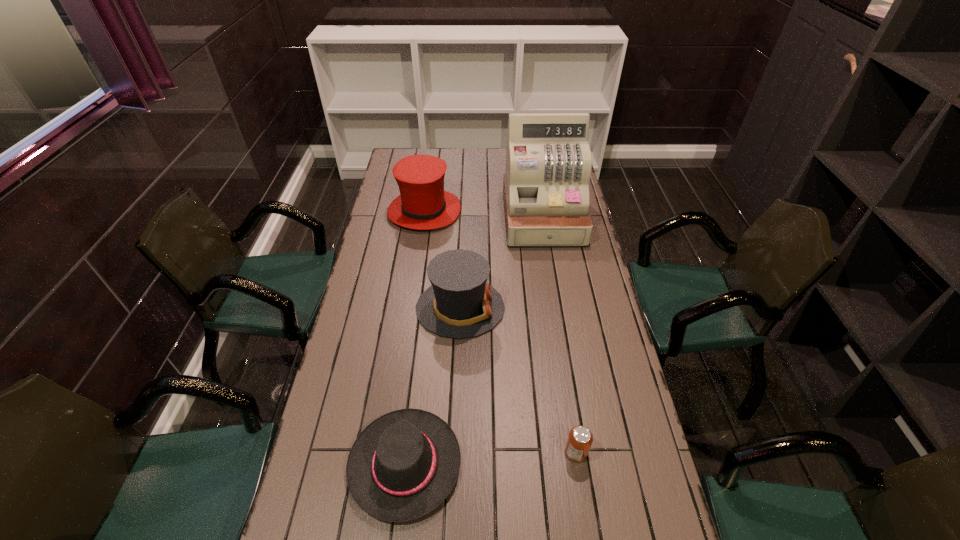
This screenshot has height=540, width=960. Find the location of `vacant space situated on the left of the can`. vacant space situated on the left of the can is located at coordinates (516, 452).

At what (x,y) coordinates should I click in order to perform the action: click on cash register at the right edge. Please return your answer as a coordinate pair (x, y). This screenshot has height=540, width=960. Looking at the image, I should click on (548, 160).

You are a GUI agent. You are given a task and a screenshot of the screen. Output one action in this format:
    pyautogui.click(x=<x>, y=<y>)
    Task: Click on the can that is at the right edge
    The image size is (960, 540).
    Given the screenshot: What is the action you would take?
    pyautogui.click(x=580, y=438)

In the image, there is a desktop. At what (x,y) coordinates should I click in order to perform the action: click on free space at the far edge. Please return your answer as a coordinate pair (x, y). The width and height of the screenshot is (960, 540). Looking at the image, I should click on (435, 156).

In the image, there is a desktop. Identify the location of vacant region at the left edge. (378, 253).

This screenshot has width=960, height=540. Identify the location of free space at the right edge. (564, 292).

The height and width of the screenshot is (540, 960). What are the coordinates of `vacant region at the far left corner of the desktop` in the screenshot? It's located at (410, 151).

The height and width of the screenshot is (540, 960). What are the coordinates of `free space that is in between the cash register and the second shortest dress hat` in the screenshot? It's located at (501, 263).

Where is `vacant point located between the tallest object and the second tallest dress hat`? vacant point located between the tallest object and the second tallest dress hat is located at coordinates (501, 263).

The width and height of the screenshot is (960, 540). Find the location of `empty space between the shortest dress hat and the farthest dress hat`. empty space between the shortest dress hat and the farthest dress hat is located at coordinates (415, 338).